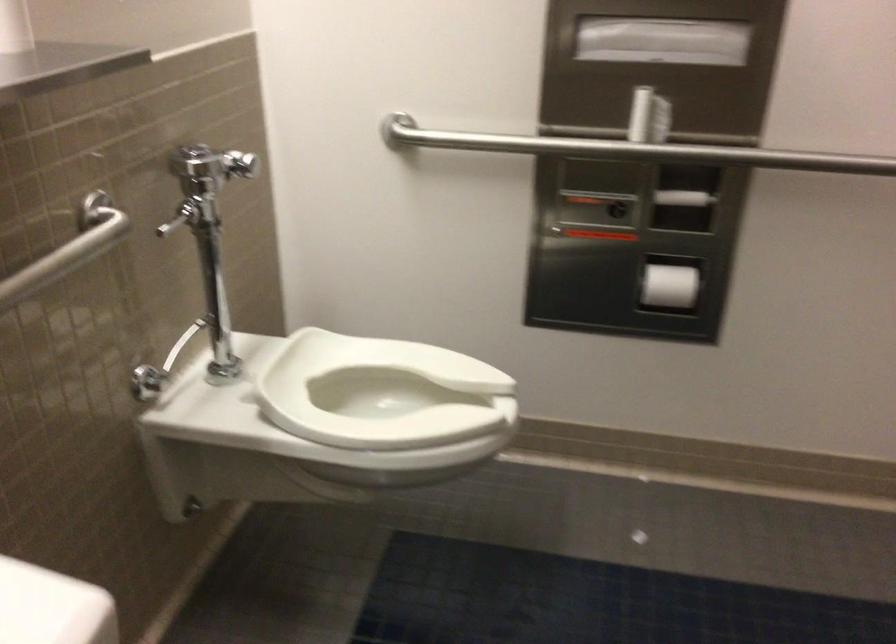
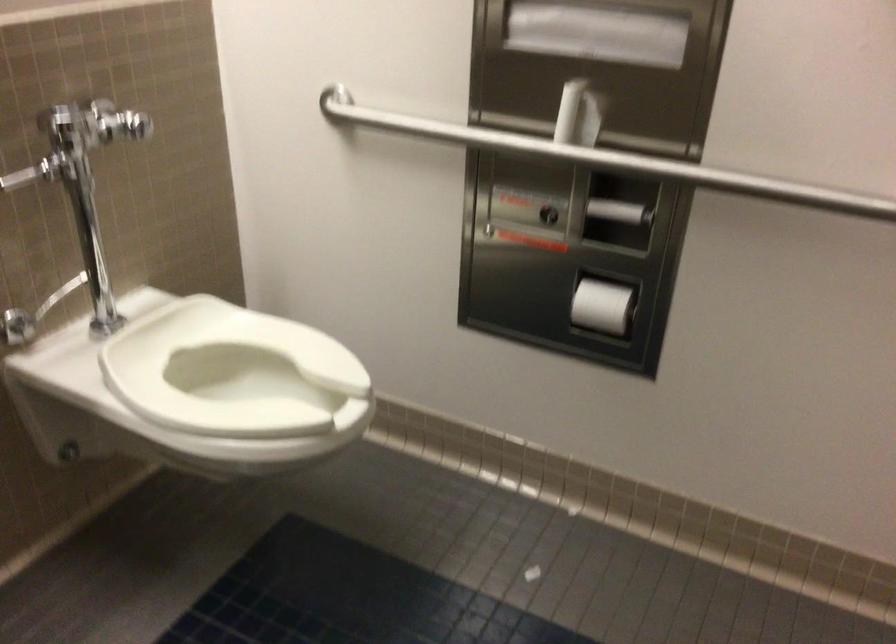
Question: The camera is either moving clockwise (left) or counter-clockwise (right) around the object. The first image is from the beginning of the video and the second image is from the end. Is the camera moving left or right when shooting the video?

Choices:
 (A) Left
 (B) Right

Answer: (B)